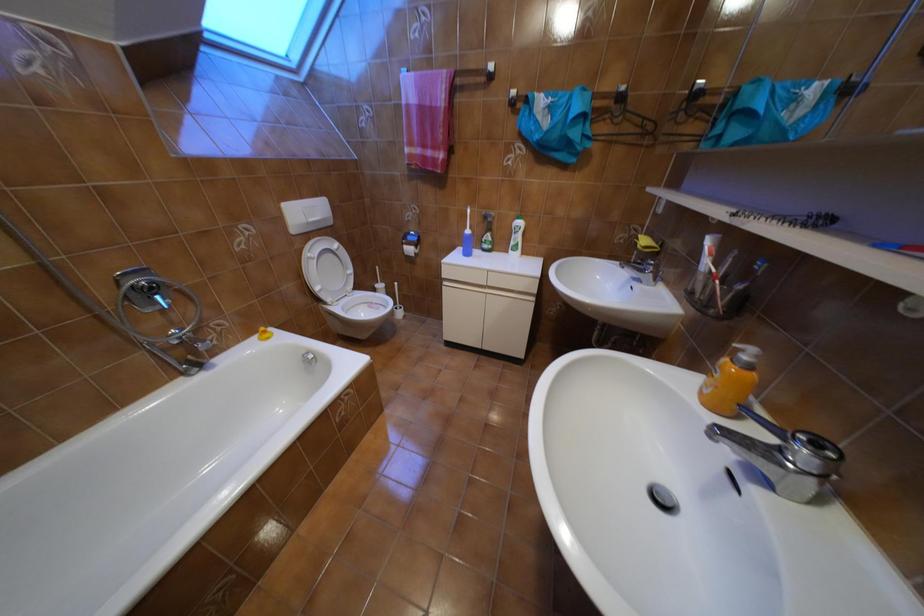
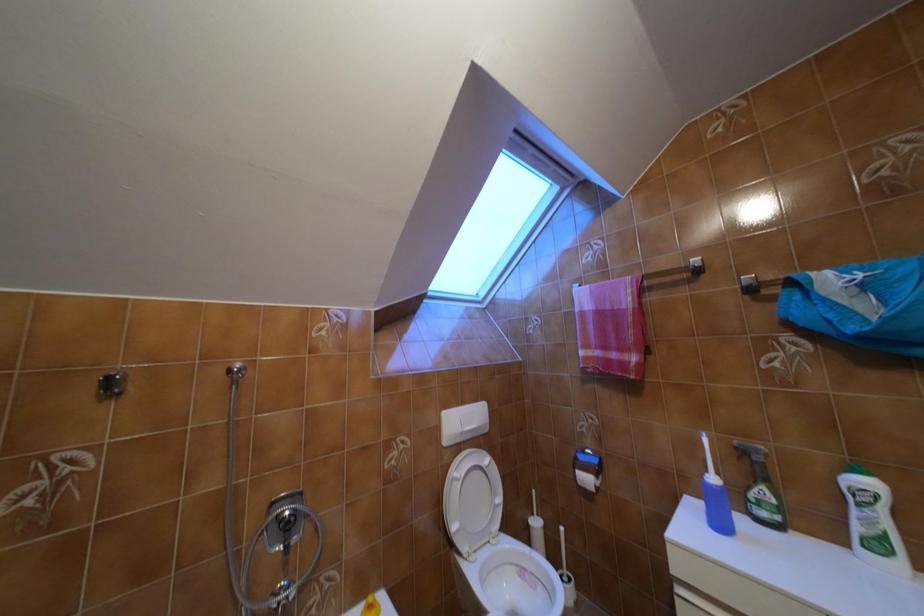
Based on the continuous images, in which direction is the camera rotating?

The camera rotated toward left-up.